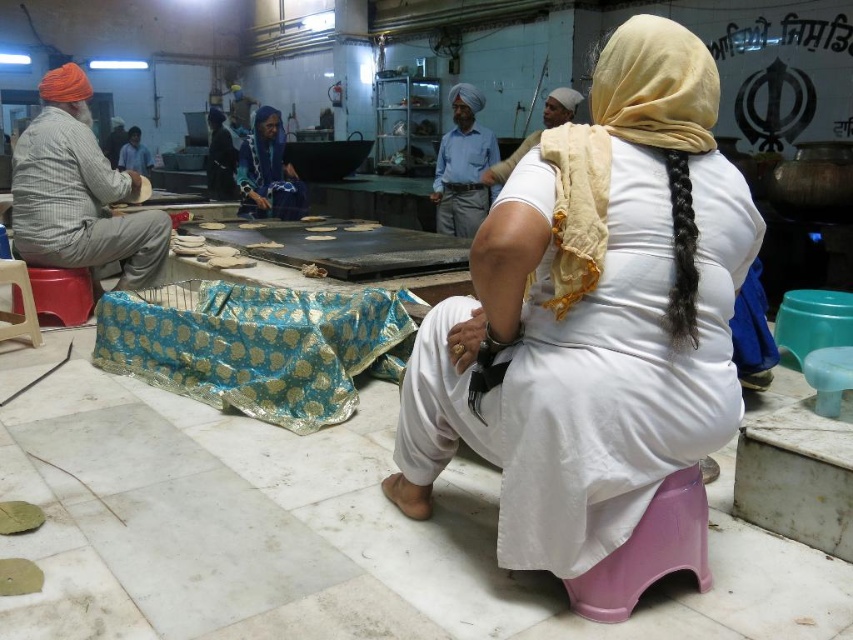
You are a guest in this kitchen and see the white cloth at center and the blue cotton shirt at center. Which item is positioned lower in the scene?

The white cloth at center is positioned lower than the blue cotton shirt at center.

You are a visitor in this kitchen and see the matte orange turban at left and the blue fabric at center. Which object is located more to the left?

The matte orange turban at left is more to the left than the blue fabric at center.